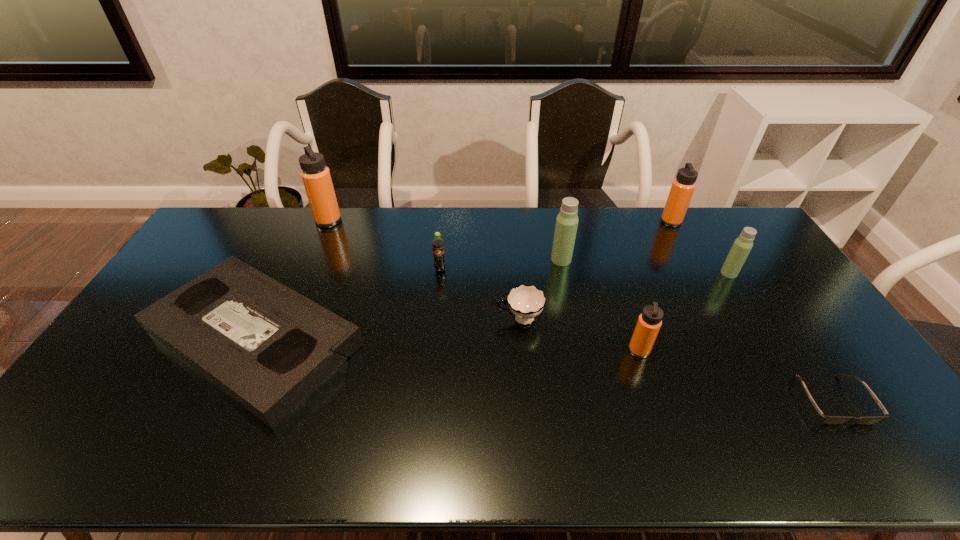
This screenshot has width=960, height=540. I want to click on blank space at the far edge of the desktop, so click(x=371, y=240).

Where is `vacant area at the near edge`? vacant area at the near edge is located at coordinates (567, 440).

Where is `vacant point at the left edge`? vacant point at the left edge is located at coordinates (139, 404).

You are a GUI agent. You are given a task and a screenshot of the screen. Output one action in this format:
    pyautogui.click(x=<x>, y=<y>)
    Task: Click on the free space at the right edge of the desktop
    
    Given the screenshot: What is the action you would take?
    pyautogui.click(x=825, y=336)

In the image, there is a desktop. Where is `vacant space at the near left corner`? vacant space at the near left corner is located at coordinates (110, 443).

Locate an element on the screen. free space between the smaller light thermos bottle and the second biggest orange thermos bottle is located at coordinates (700, 247).

At what (x,y) coordinates should I click in order to perform the action: click on free space that is in between the third thermos bottle from left to right and the black sunglasses. Please return your answer as a coordinate pair (x, y). This screenshot has height=540, width=960. Looking at the image, I should click on click(x=735, y=375).

This screenshot has width=960, height=540. Identify the location of vacant area between the green soda and the second shortest object. (347, 304).

Where is `free space between the videotape and the second orange thermos bottle from right to left`? This screenshot has height=540, width=960. free space between the videotape and the second orange thermos bottle from right to left is located at coordinates (446, 345).

The width and height of the screenshot is (960, 540). Identify the location of blank region between the leftmost orange thermos bottle and the shortest object. (580, 310).